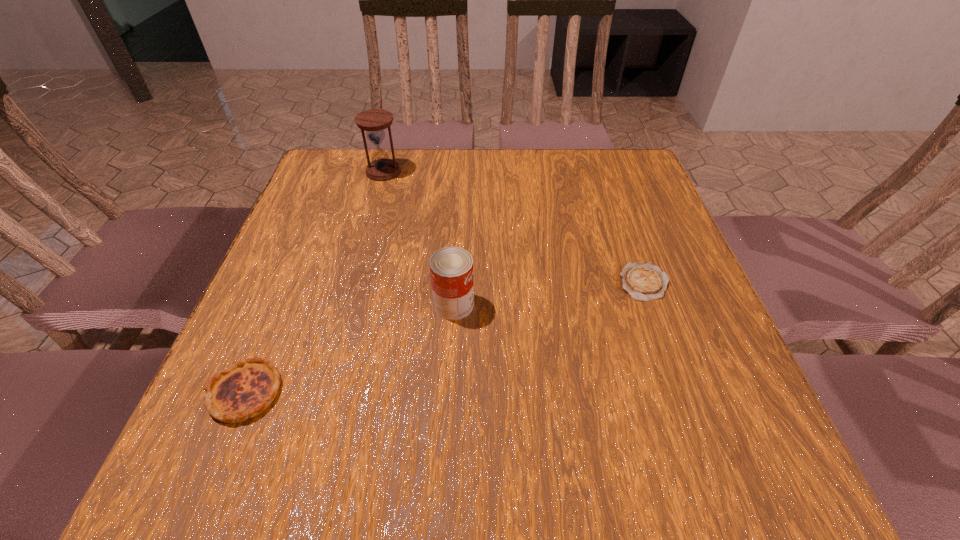
The height and width of the screenshot is (540, 960). I want to click on blank space at the right edge of the desktop, so click(x=636, y=207).

This screenshot has height=540, width=960. In order to click on free space at the far left corner of the desktop in this screenshot , I will do `click(346, 179)`.

What are the coordinates of `vacant space at the near left corner` in the screenshot? It's located at (275, 477).

Where is `free spot at the far right corner of the desktop`? The image size is (960, 540). free spot at the far right corner of the desktop is located at coordinates (638, 176).

Locate an element on the screen. Image resolution: width=960 pixels, height=540 pixels. free space between the third shortest object and the taller quiche is located at coordinates (349, 349).

Image resolution: width=960 pixels, height=540 pixels. Identify the location of vacant space in between the hourglass and the shorter quiche. (514, 227).

The width and height of the screenshot is (960, 540). What are the coordinates of `vacant area between the can and the right quiche` in the screenshot? It's located at (549, 294).

Where is `empty space between the tallest object and the shortest object`? empty space between the tallest object and the shortest object is located at coordinates (514, 227).

Find the location of a particular element. This screenshot has height=540, width=960. vacant space that's between the shorter quiche and the can is located at coordinates (549, 294).

At what (x,y) coordinates should I click in order to perform the action: click on empty space between the nearer quiche and the hourglass. Please return your answer as a coordinate pair (x, y). Looking at the image, I should click on (315, 282).